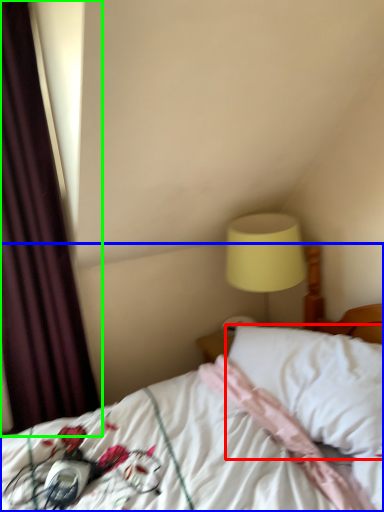
Question: Estimate the real-world distances between objects in this image. Which object is closer to pillow (highlighted by a red box), bed (highlighted by a blue box) or curtain (highlighted by a green box)?

Choices:
 (A) bed
 (B) curtain

Answer: (A)